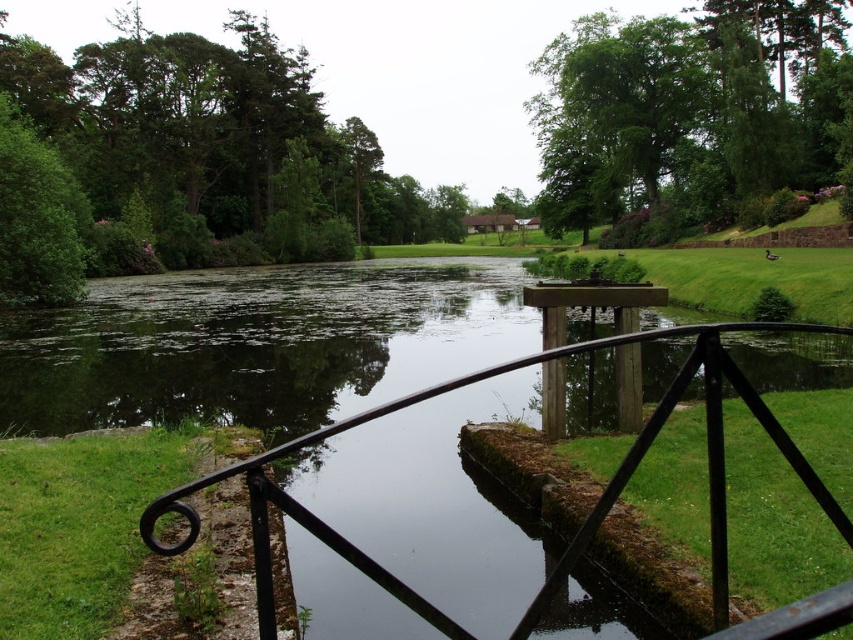
Is green leafy tree at upper center smaller than black wrought iron rail at center?

Incorrect, green leafy tree at upper center is not smaller in size than black wrought iron rail at center.

How distant is green leafy tree at upper center from black wrought iron rail at center?

They are 50.97 meters apart.

Who is more forward, [770,104] or [421,614]?

Point [421,614] is more forward.

You are a GUI agent. You are given a task and a screenshot of the screen. Output one action in this format:
    pyautogui.click(x=<x>, y=<y>)
    Task: Click on the green leafy tree at upper center
    Image resolution: width=853 pixels, height=640 pixels.
    Given the screenshot: What is the action you would take?
    pyautogui.click(x=689, y=112)

Is black wrought iron rail at center further to the viewer compared to green leafy tree at upper left?

No, black wrought iron rail at center is in front of green leafy tree at upper left.

Image resolution: width=853 pixels, height=640 pixels. I want to click on black wrought iron rail at center, so coord(585,516).

Locate an element on the screen. black wrought iron rail at center is located at coordinates (585, 516).

The width and height of the screenshot is (853, 640). Identify the location of green leafy tree at upper center. (689, 112).

Between green leafy tree at upper center and green leafy tree at upper left, which one appears on the left side from the viewer's perspective?

Positioned to the left is green leafy tree at upper left.

Where is `green leafy tree at upper center`? green leafy tree at upper center is located at coordinates coord(689,112).

This screenshot has width=853, height=640. Identify the location of green leafy tree at upper center. (689, 112).